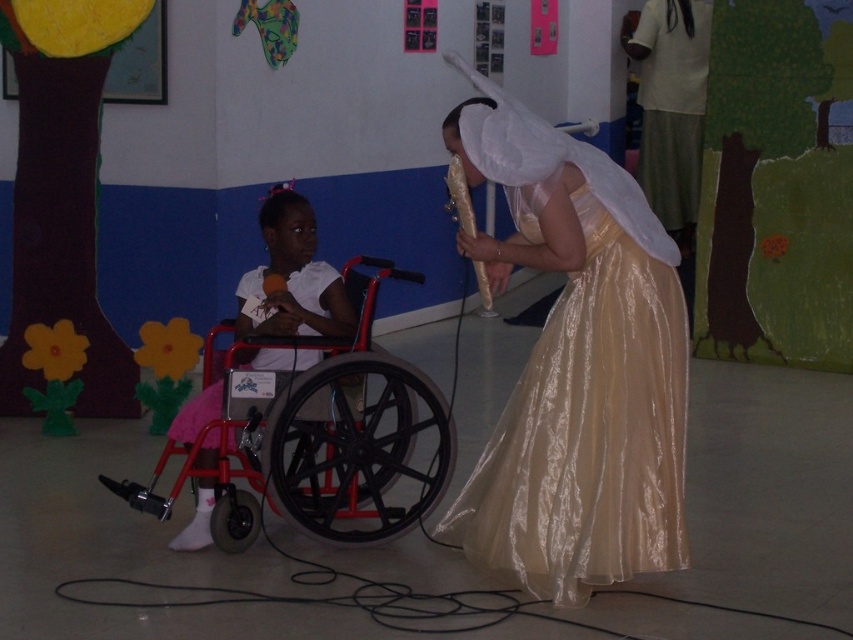
Question: Can you confirm if red plastic wheelchair at left is positioned above white satin dress at left?

Choices:
 (A) no
 (B) yes

Answer: (A)

Question: Which point appears closest to the camera in this image?

Choices:
 (A) (306, 280)
 (B) (305, 243)

Answer: (B)

Question: Can you confirm if shiny gold dress at center is positioned to the right of white satin dress at left?

Choices:
 (A) yes
 (B) no

Answer: (A)

Question: Which point is farther to the camera?

Choices:
 (A) pink satin dress at left
 (B) shiny gold dress at center

Answer: (A)

Question: Does red plastic wheelchair at left appear under white satin dress at left?

Choices:
 (A) yes
 (B) no

Answer: (A)

Question: Estimate the real-world distances between objects in this image. Which object is farther from the red plastic wheelchair at left?

Choices:
 (A) shiny gold dress at center
 (B) pink satin dress at left
 (C) white satin dress at left

Answer: (A)